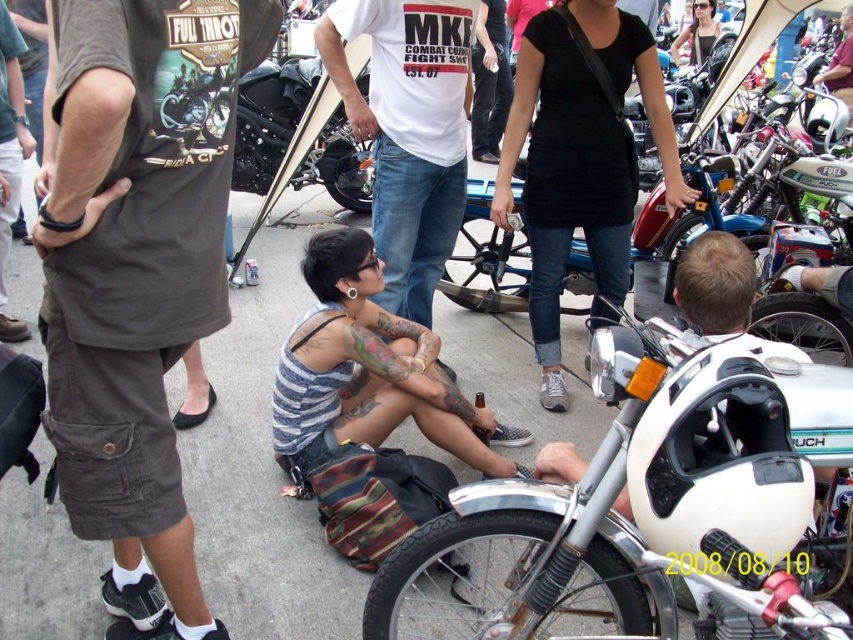
Question: Is gray asphalt pavement at center wider than matte black tank top at center?

Choices:
 (A) no
 (B) yes

Answer: (B)

Question: Can you confirm if black matte shirt at center is bigger than shiny black motorcycle at center?

Choices:
 (A) yes
 (B) no

Answer: (B)

Question: Can you confirm if dark gray cargo shorts at center is bigger than white cotton t-shirt at center?

Choices:
 (A) yes
 (B) no

Answer: (B)

Question: Which point appears closest to the camera in this image?

Choices:
 (A) (606, 236)
 (B) (123, 410)

Answer: (B)

Question: Estimate the real-world distances between objects in this image. Which object is closer to the white cotton t-shirt at center?

Choices:
 (A) white matte motorcycle at lower right
 (B) black matte shirt at center

Answer: (B)

Question: Among these points, which one is nearest to the camera?

Choices:
 (A) (393, 42)
 (B) (724, 532)
 (C) (320, 144)
 (D) (119, 218)

Answer: (B)